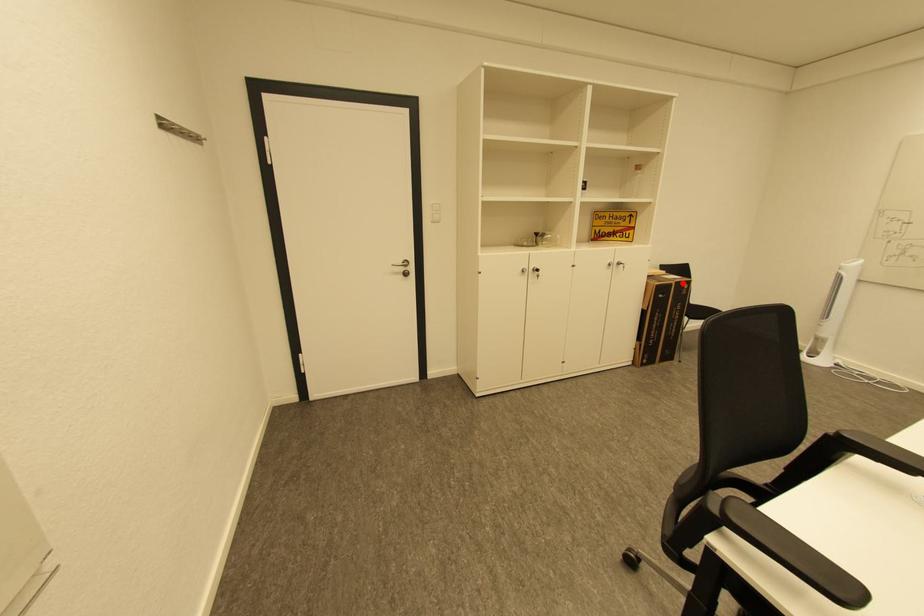
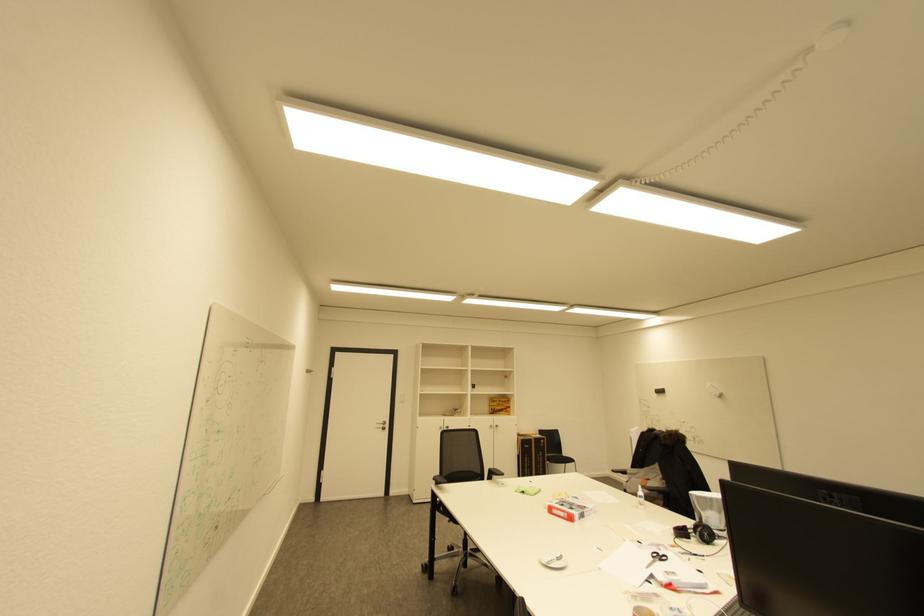
Question: I am providing you with two images of the same scene from different viewpoints. Image1 has a red point marked. In image2, the corresponding 3D location appears at what relative position? Reply with the corresponding letter.

Choices:
 (A) Closer
 (B) Farther

Answer: (B)